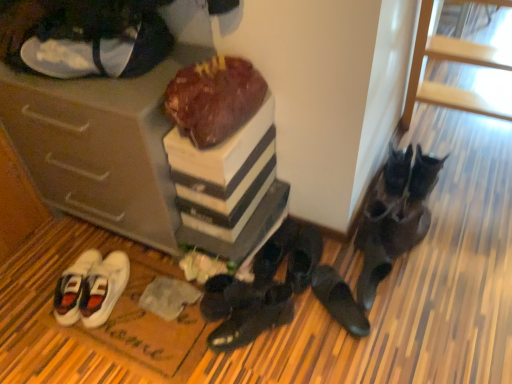
This screenshot has height=384, width=512. What do you see at coordinates (214, 99) in the screenshot?
I see `chocolate cake at center` at bounding box center [214, 99].

The image size is (512, 384). What do you see at coordinates (304, 258) in the screenshot?
I see `black leather shoes at lower center, the third footwear when ordered from right to left` at bounding box center [304, 258].

Find the location of a particular element. This screenshot has width=512, height=384. black suede shoes at center, which ranks as the 3th footwear in left-to-right order is located at coordinates (251, 313).

In order to face white canvas sneakers at upper left, which appears as the second footwear when viewed from the left, should I rotate leftwards or rightwards?

Rotate your view left by about 20.805°.

Where is `black leather shoes at lower right, which is the 6th footwear in left-to-right order`? Image resolution: width=512 pixels, height=384 pixels. black leather shoes at lower right, which is the 6th footwear in left-to-right order is located at coordinates (339, 300).

Considering the relative positions of black leather shoes at lower right, acting as the 2th footwear starting from the right, and matte brown cabinet at lower left in the image provided, is black leather shoes at lower right, acting as the 2th footwear starting from the right, to the right of matte brown cabinet at lower left from the viewer's perspective?

Indeed, black leather shoes at lower right, acting as the 2th footwear starting from the right, is positioned on the right side of matte brown cabinet at lower left.

From a real-world perspective, is black leather shoes at lower right, which is the 6th footwear in left-to-right order, beneath matte brown cabinet at lower left?

Yes, from a real-world perspective, black leather shoes at lower right, which is the 6th footwear in left-to-right order, is below matte brown cabinet at lower left.

Is white canvas sneakers at upper left, which appears as the second footwear when viewed from the left, in front of or behind black leather shoes at center, the fourth footwear in the right-to-left sequence, in the image?

white canvas sneakers at upper left, which appears as the second footwear when viewed from the left, is in front of black leather shoes at center, the fourth footwear in the right-to-left sequence.

Can you tell me how much white canvas sneakers at upper left, which appears as the second footwear when viewed from the left, and black leather shoes at center, the fourth footwear from the left, differ in facing direction?

5.4 degrees.

Does white canvas sneakers at upper left, the 6th footwear positioned from the right, have a larger size compared to black leather shoes at center, the fourth footwear in the right-to-left sequence?

Indeed, white canvas sneakers at upper left, the 6th footwear positioned from the right, has a larger size compared to black leather shoes at center, the fourth footwear in the right-to-left sequence.

From the image's perspective, is white canvas sneakers at upper left, the 6th footwear positioned from the right, below black leather shoes at center, the fourth footwear in the right-to-left sequence?

No, from the image's perspective, white canvas sneakers at upper left, the 6th footwear positioned from the right, is not beneath black leather shoes at center, the fourth footwear in the right-to-left sequence.

In the image, is chocolate cake at center on the left side or the right side of black leather shoes at lower right, acting as the 2th footwear starting from the right?

In the image, chocolate cake at center appears on the left side of black leather shoes at lower right, acting as the 2th footwear starting from the right.

From the image's perspective, is chocolate cake at center under black leather shoes at lower right, acting as the 2th footwear starting from the right?

No, from the image's perspective, chocolate cake at center is not beneath black leather shoes at lower right, acting as the 2th footwear starting from the right.

Does chocolate cake at center have a lesser height compared to black leather shoes at lower right, which is the 6th footwear in left-to-right order?

No.

Could you tell me if chocolate cake at center is turned towards black leather shoes at lower right, which is the 6th footwear in left-to-right order?

No, chocolate cake at center is not oriented towards black leather shoes at lower right, which is the 6th footwear in left-to-right order.

From their relative heights in the image, would you say matte brown cabinet at lower left is taller or shorter than black leather shoes at lower right, which is the 6th footwear in left-to-right order?

matte brown cabinet at lower left is taller than black leather shoes at lower right, which is the 6th footwear in left-to-right order.

From the image's perspective, relative to black leather shoes at lower right, acting as the 2th footwear starting from the right, is matte brown cabinet at lower left above or below?

Based on their image positions, matte brown cabinet at lower left is located above black leather shoes at lower right, acting as the 2th footwear starting from the right.

Is matte brown cabinet at lower left bigger than black leather shoes at lower right, acting as the 2th footwear starting from the right?

Yes, matte brown cabinet at lower left is bigger than black leather shoes at lower right, acting as the 2th footwear starting from the right.

Could you tell me if matte brown cabinet at lower left is facing black leather shoes at lower right, which is the 6th footwear in left-to-right order?

No, matte brown cabinet at lower left is not facing towards black leather shoes at lower right, which is the 6th footwear in left-to-right order.

Would you say white canvas sneakers at lower left, which appears as the 7th footwear when viewed from the right, is a long distance from white canvas sneakers at upper left, which appears as the second footwear when viewed from the left?

Actually, white canvas sneakers at lower left, which appears as the 7th footwear when viewed from the right, and white canvas sneakers at upper left, which appears as the second footwear when viewed from the left, are a little close together.

You are a GUI agent. You are given a task and a screenshot of the screen. Output one action in this format:
    pyautogui.click(x=<x>, y=<y>)
    Task: Click on the 3rd footwear directly beneath the white canvas sneakers at upper left, which appears as the second footwear when viewed from the left (from a real-world perspective)
    The image size is (512, 384).
    Given the screenshot: What is the action you would take?
    pyautogui.click(x=103, y=289)

How distant is white canvas sneakers at lower left, the first footwear in the left-to-right sequence, from white canvas sneakers at upper left, the 6th footwear positioned from the right?

A distance of 31.10 inches exists between white canvas sneakers at lower left, the first footwear in the left-to-right sequence, and white canvas sneakers at upper left, the 6th footwear positioned from the right.

Is white canvas sneakers at upper left, which appears as the second footwear when viewed from the left, facing away from black suede shoes at lower right, the 1th footwear positioned from the right?

No, white canvas sneakers at upper left, which appears as the second footwear when viewed from the left, is not facing the opposite direction of black suede shoes at lower right, the 1th footwear positioned from the right.

Consider the image. How distant is white canvas sneakers at upper left, which appears as the second footwear when viewed from the left, from black suede shoes at lower right, the 1th footwear positioned from the right?

white canvas sneakers at upper left, which appears as the second footwear when viewed from the left, and black suede shoes at lower right, the 1th footwear positioned from the right, are 3.43 feet apart.

Considering the sizes of white canvas sneakers at upper left, which appears as the second footwear when viewed from the left, and black suede shoes at lower right, which appears as the 7th footwear when viewed from the left, in the image, is white canvas sneakers at upper left, which appears as the second footwear when viewed from the left, bigger or smaller than black suede shoes at lower right, which appears as the 7th footwear when viewed from the left,?

white canvas sneakers at upper left, which appears as the second footwear when viewed from the left, is bigger than black suede shoes at lower right, which appears as the 7th footwear when viewed from the left.

Is chocolate cake at center taller or shorter than black suede shoes at center, which ranks as the 3th footwear in left-to-right order?

Considering their sizes, chocolate cake at center has more height than black suede shoes at center, which ranks as the 3th footwear in left-to-right order.

In terms of width, does chocolate cake at center look wider or thinner when compared to black suede shoes at center, which ranks as the 3th footwear in left-to-right order?

In the image, chocolate cake at center appears to be wider than black suede shoes at center, which ranks as the 3th footwear in left-to-right order.

Considering the points (234, 122) and (236, 285), which point is behind, point (234, 122) or point (236, 285)?

Point (236, 285)

Is chocolate cake at center aimed at black suede shoes at center, which ranks as the 3th footwear in left-to-right order?

No, chocolate cake at center is not aimed at black suede shoes at center, which ranks as the 3th footwear in left-to-right order.

Locate an element on the screen. The height and width of the screenshot is (384, 512). cabinetry located above the black leather shoes at lower right, which is the 6th footwear in left-to-right order (from the image's perspective) is located at coordinates (100, 146).

The width and height of the screenshot is (512, 384). In order to click on footwear that is the 6th object located behind the white canvas sneakers at upper left, which appears as the second footwear when viewed from the left in this screenshot , I will do `click(274, 252)`.

When comparing their distances from black leather shoes at center, the fourth footwear in the right-to-left sequence, does black leather shoes at lower right, which is the 6th footwear in left-to-right order, or matte brown cabinet at lower left seem further?

matte brown cabinet at lower left.

Estimate the real-world distances between objects in this image. Which object is further from chocolate cake at center, black suede shoes at lower right, the 1th footwear positioned from the right, or white canvas sneakers at lower left, the first footwear in the left-to-right sequence?

Based on the image, white canvas sneakers at lower left, the first footwear in the left-to-right sequence, appears to be further to chocolate cake at center.

Looking at this image, estimate the real-world distances between objects in this image. Which object is closer to white canvas sneakers at upper left, which appears as the second footwear when viewed from the left, white canvas sneakers at lower left, the first footwear in the left-to-right sequence, or black suede shoes at center, which is counted as the fifth footwear, starting from the right?

white canvas sneakers at lower left, the first footwear in the left-to-right sequence, is closer to white canvas sneakers at upper left, which appears as the second footwear when viewed from the left.

From the image, which object appears to be nearer to black leather shoes at lower right, which is the 6th footwear in left-to-right order, black suede shoes at center, which ranks as the 3th footwear in left-to-right order, or black leather shoes at lower center, the third footwear when ordered from right to left?

black leather shoes at lower center, the third footwear when ordered from right to left, is positioned closer to the anchor black leather shoes at lower right, which is the 6th footwear in left-to-right order.

From the image, which object appears to be farther from black leather shoes at lower center, the 5th footwear positioned from the left, white canvas sneakers at lower left, which appears as the 7th footwear when viewed from the right, or black leather shoes at center, the fourth footwear in the right-to-left sequence?

white canvas sneakers at lower left, which appears as the 7th footwear when viewed from the right, is further to black leather shoes at lower center, the 5th footwear positioned from the left.

Based on their spatial positions, is black leather shoes at center, the fourth footwear from the left, or matte brown cabinet at lower left closer to chocolate cake at center?

The object closer to chocolate cake at center is matte brown cabinet at lower left.

In the scene shown: Considering their positions, is black leather shoes at lower right, which is the 6th footwear in left-to-right order, positioned further to matte brown cabinet at lower left than black suede shoes at lower right, the 1th footwear positioned from the right?

black suede shoes at lower right, the 1th footwear positioned from the right, is further to matte brown cabinet at lower left.

Considering their positions, is black suede shoes at lower right, which appears as the 7th footwear when viewed from the left, positioned closer to white canvas sneakers at upper left, which appears as the second footwear when viewed from the left, than chocolate cake at center?

chocolate cake at center is closer to white canvas sneakers at upper left, which appears as the second footwear when viewed from the left.

This screenshot has height=384, width=512. I want to click on chocolate cake between matte brown cabinet at lower left and black leather shoes at lower center, the 5th footwear positioned from the left, in the horizontal direction, so (x=214, y=99).

Identify the location of cabinetry between white canvas sneakers at lower left, the first footwear in the left-to-right sequence, and black leather shoes at center, the fourth footwear in the right-to-left sequence, from left to right. The width and height of the screenshot is (512, 384). (100, 146).

The height and width of the screenshot is (384, 512). Identify the location of chocolate cake between white canvas sneakers at lower left, which appears as the 7th footwear when viewed from the right, and black leather shoes at lower right, which is the 6th footwear in left-to-right order, from left to right. (214, 99).

I want to click on chocolate cake between white canvas sneakers at upper left, the 6th footwear positioned from the right, and white canvas sneakers at lower left, the first footwear in the left-to-right sequence, in the vertical direction, so click(x=214, y=99).